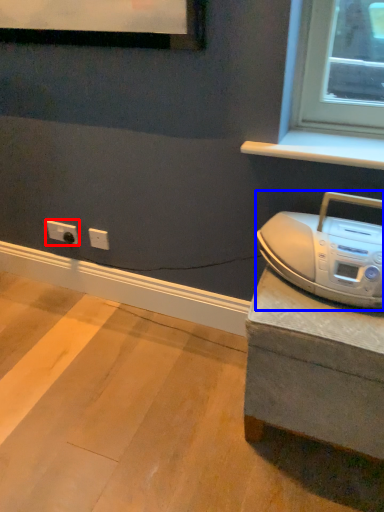
Question: Which of the following is the closest to the observer, electric outlet (highlighted by a red box) or home appliance (highlighted by a blue box)?

Choices:
 (A) electric outlet
 (B) home appliance

Answer: (B)